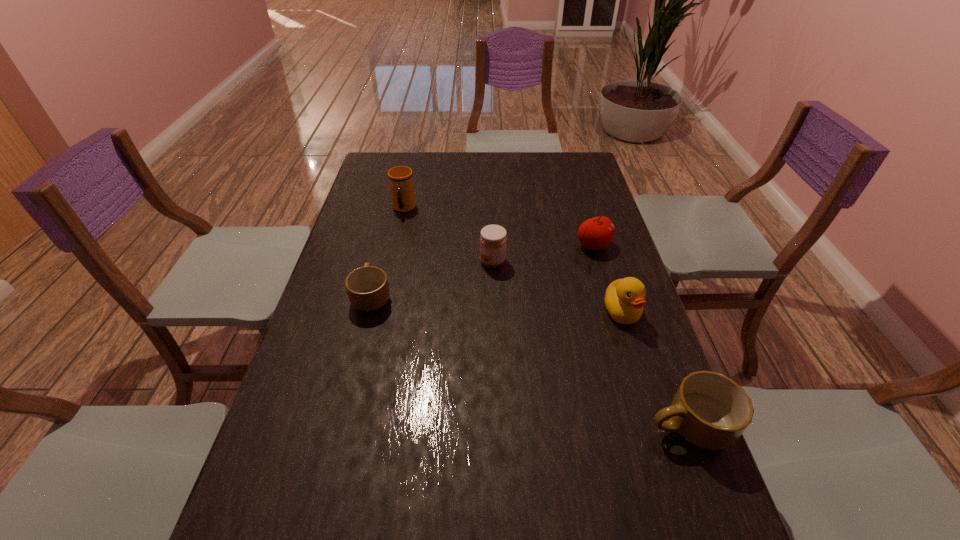
You are a GUI agent. You are given a task and a screenshot of the screen. Output one action in this format:
    pyautogui.click(x=<x>, y=<y>)
    Task: Click on the mug that is at the left edge
    
    Given the screenshot: What is the action you would take?
    pyautogui.click(x=367, y=287)

This screenshot has height=540, width=960. I want to click on cup present at the left edge, so click(401, 184).

Locate an element on the screen. mug present at the right edge is located at coordinates (711, 411).

In order to click on apple located in the right edge section of the desktop in this screenshot , I will do `click(596, 233)`.

Identify the location of duck that is positioned at the right edge. This screenshot has height=540, width=960. (624, 299).

At what (x,y) coordinates should I click in order to perform the action: click on free space at the far edge of the desktop. Please return your answer as a coordinate pair (x, y). The width and height of the screenshot is (960, 540). Looking at the image, I should click on (535, 164).

Find the location of a particular element. vacant area at the left edge of the desktop is located at coordinates (364, 249).

You are a GUI agent. You are given a task and a screenshot of the screen. Output one action in this format:
    pyautogui.click(x=<x>, y=<y>)
    Task: Click on the vacant space at the right edge of the desktop
    
    Given the screenshot: What is the action you would take?
    pyautogui.click(x=589, y=334)

Image resolution: width=960 pixels, height=540 pixels. I want to click on blank space at the near left corner of the desktop, so click(x=300, y=496).

This screenshot has width=960, height=540. I want to click on free space at the far right corner of the desktop, so click(x=584, y=175).